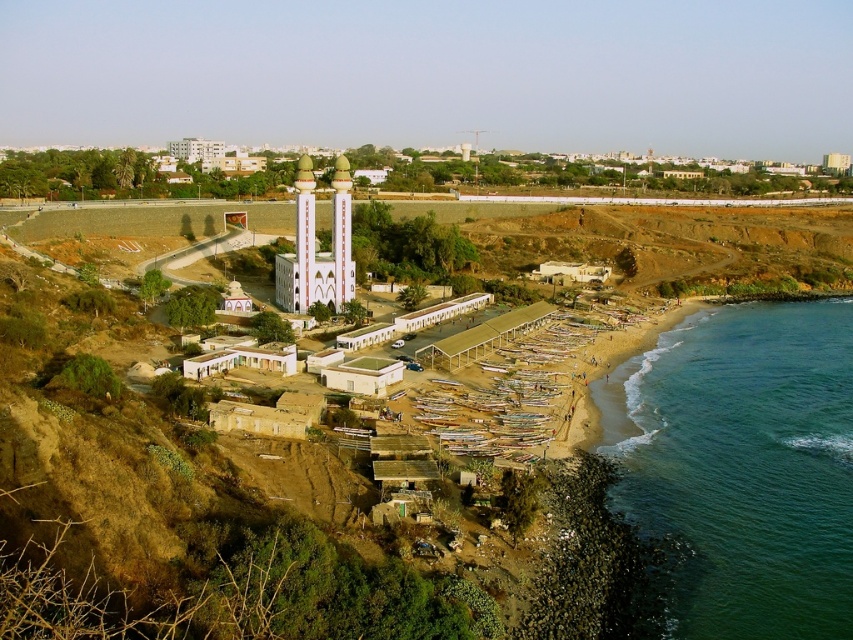
Question: Observing the image, what is the correct spatial positioning of green smooth water at beach right in reference to white glossy tower at center?

Choices:
 (A) left
 (B) right

Answer: (B)

Question: Which object is the closest to the green smooth water at beach right?

Choices:
 (A) white smooth mosque at center
 (B) white glossy tower at center

Answer: (A)

Question: Is green smooth water at beach right smaller than white glossy tower at center?

Choices:
 (A) no
 (B) yes

Answer: (A)

Question: Does green smooth water at beach right come in front of white smooth mosque at center?

Choices:
 (A) yes
 (B) no

Answer: (A)

Question: Estimate the real-world distances between objects in this image. Which object is closer to the white glossy tower at center?

Choices:
 (A) green smooth water at beach right
 (B) white smooth mosque at center

Answer: (B)

Question: Which point appears closest to the camera in this image?

Choices:
 (A) (337, 244)
 (B) (776, 420)
 (C) (337, 305)

Answer: (B)